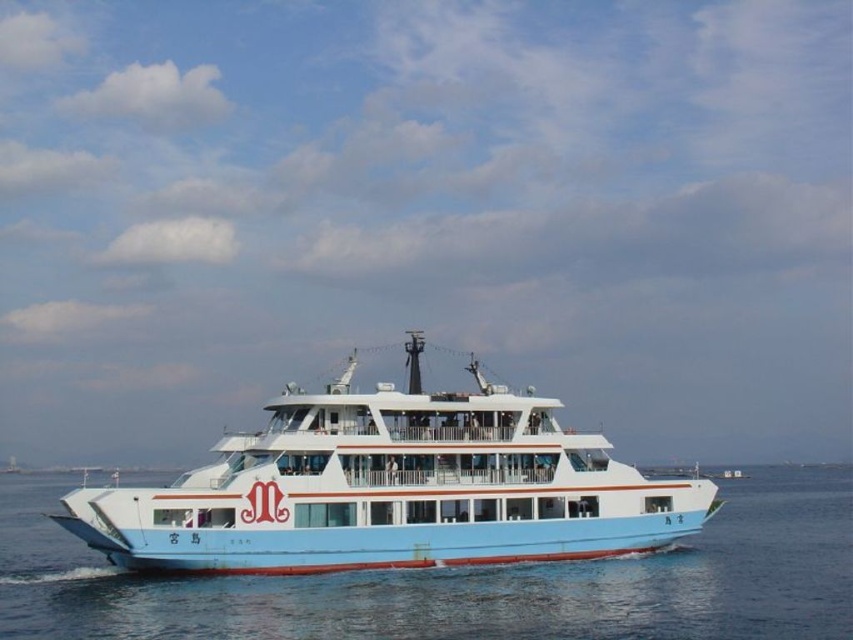
You are standing on the ferry and want to place a small toy boat exactly at the center of the ferry. According to the image, where should you place the light blue plastic boat at center?

The light blue plastic boat at center should be placed at the coordinates point (392, 488) to be exactly at the center of the ferry.

You are a passenger on the ferry and want to place your light blue plastic boat at center into a storage compartment that can only hold items smaller than the blue water at center. Will your boat fit?

The light blue plastic boat at center is smaller than the blue water at center, so it will fit in the storage compartment.

You are a passenger on the ferry and want to know if you can safely place a small toy boat that is the same size as the light blue plastic boat at center into a container that can only hold items shorter than the blue water at center. Can you do this?

The light blue plastic boat at center is much taller than the blue water at center. Since the container can only hold items shorter than the blue water at center, the toy boat cannot be placed into the container.